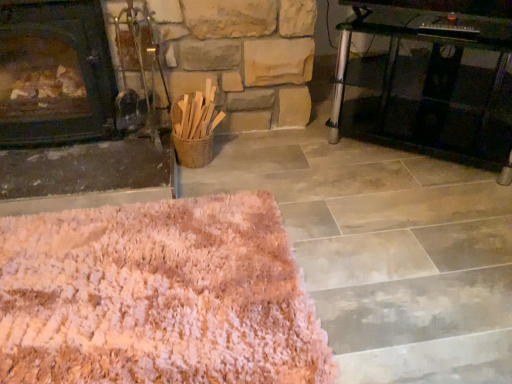
Question: Is dark wood fireplace at left wider or thinner than pink shaggy rug at lower left?

Choices:
 (A) thin
 (B) wide

Answer: (A)

Question: Considering their positions, is dark wood fireplace at left located in front of or behind pink shaggy rug at lower left?

Choices:
 (A) behind
 (B) front

Answer: (A)

Question: Estimate the real-world distances between objects in this image. Which object is farther from the transparent glass table at right?

Choices:
 (A) dark wood fireplace at left
 (B) pink shaggy rug at lower left

Answer: (A)

Question: Which of these objects is positioned closest to the transparent glass table at right?

Choices:
 (A) dark wood fireplace at left
 (B) pink shaggy rug at lower left

Answer: (B)